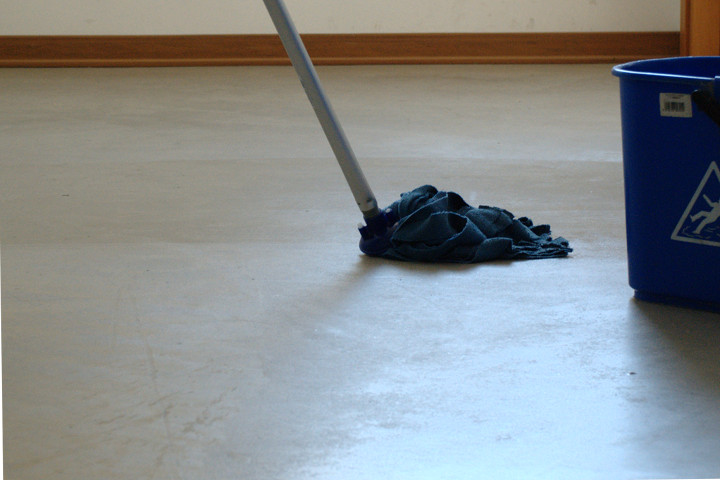
In order to click on quarter round trim in this screenshot , I will do `click(384, 59)`.